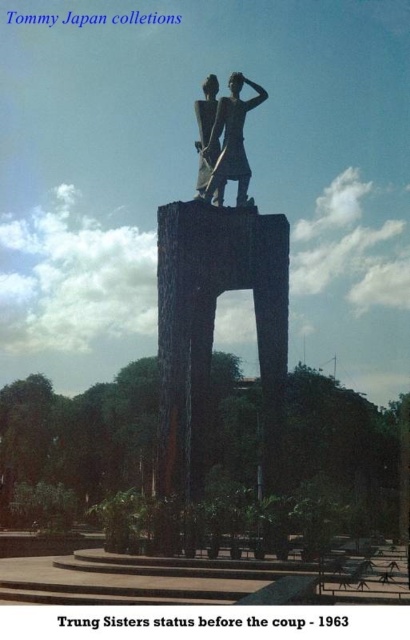
Which is below, bronze statue at center or dark gray stone statue at center?

bronze statue at center is below.

Is point (223, 150) positioned after point (211, 99)?

No, (223, 150) is in front of (211, 99).

Identify the location of bronze statue at center. Image resolution: width=410 pixels, height=640 pixels. (230, 141).

Looking at this image, does polished bronze statue at center appear under dark gray stone statue at center?

Yes, polished bronze statue at center is below dark gray stone statue at center.

Is polished bronze statue at center smaller than dark gray stone statue at center?

Incorrect, polished bronze statue at center is not smaller in size than dark gray stone statue at center.

Between point (268, 275) and point (220, 150), which one is positioned in front?

Positioned in front is point (268, 275).

Where is `polished bronze statue at center`? polished bronze statue at center is located at coordinates (216, 296).

Can you confirm if polished bronze statue at center is positioned above bronze statue at center?

No, polished bronze statue at center is not above bronze statue at center.

Between polished bronze statue at center and bronze statue at center, which one has less height?

With less height is bronze statue at center.

Locate an element on the screen. polished bronze statue at center is located at coordinates (216, 296).